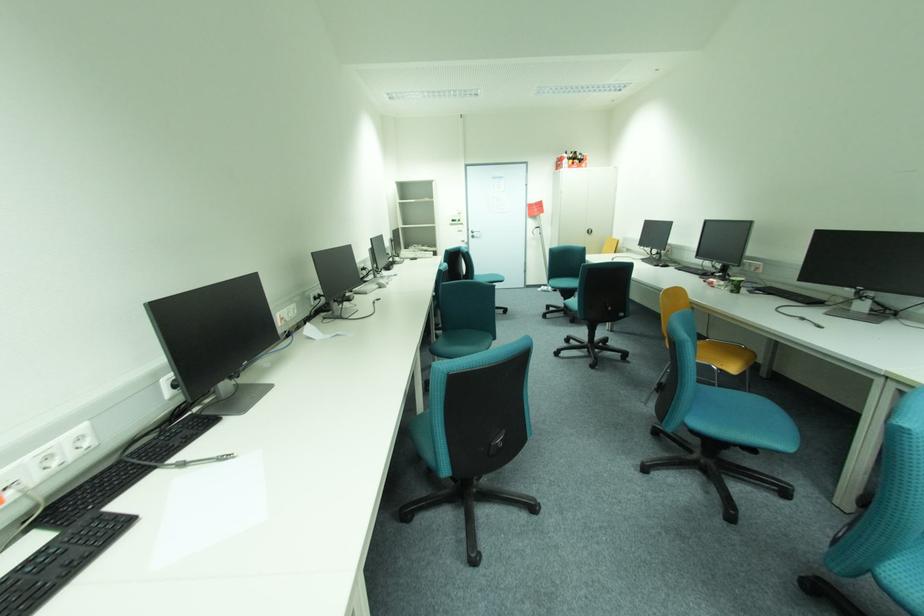
What do you see at coordinates (475, 233) in the screenshot? The width and height of the screenshot is (924, 616). I see `a metal door handle` at bounding box center [475, 233].